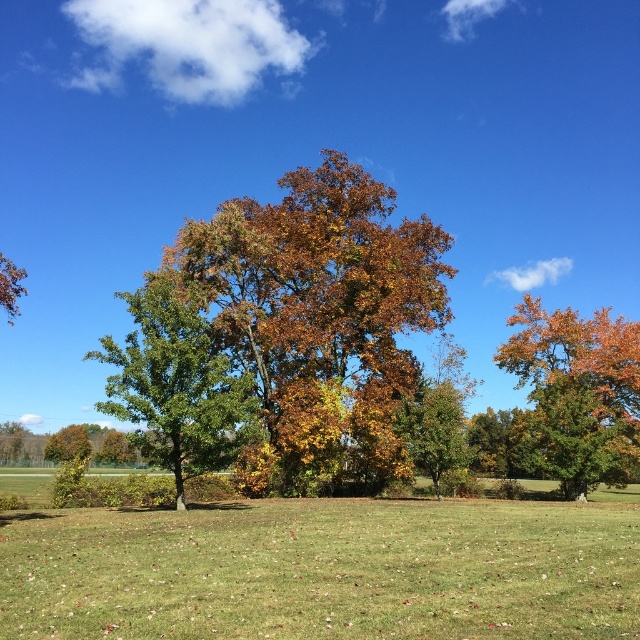
You are standing at the point labeled point [72,440] in the image. The distance between you and the viewer is 78.11 meters. If you want to move closer to the viewer, which direction should you walk?

To move closer to the viewer, you should walk towards the direction opposite of where you are currently positioned relative to the viewer. Since the distance is 78.11 meters, moving towards the viewer would reduce this distance.